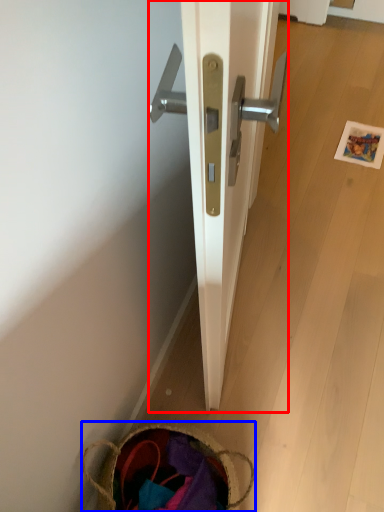
Question: Among these objects, which one is farthest to the camera, door (highlighted by a red box) or basket (highlighted by a blue box)?

Choices:
 (A) door
 (B) basket

Answer: (B)